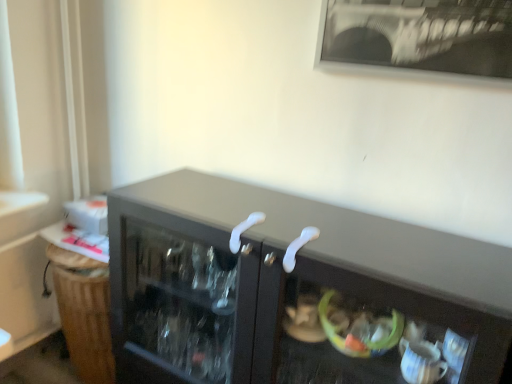
The height and width of the screenshot is (384, 512). What do you see at coordinates (298, 247) in the screenshot?
I see `white plastic door handle at center, which is counted as the second door handle, starting from the left` at bounding box center [298, 247].

You are a GUI agent. You are given a task and a screenshot of the screen. Output one action in this format:
    pyautogui.click(x=<x>, y=<y>)
    Task: Click on the white plastic door handle at center, which is counted as the second door handle, starting from the left
    
    Given the screenshot: What is the action you would take?
    pyautogui.click(x=298, y=247)

What is the approximate width of white plastic door handle at center, which is the 1th door handle in right-to-left order?

white plastic door handle at center, which is the 1th door handle in right-to-left order, is 6.50 inches in width.

Describe the element at coordinates (244, 230) in the screenshot. This screenshot has width=512, height=384. I see `white plastic door handle at center, the 1th door handle in the left-to-right sequence` at that location.

What is the approximate height of white plastic door handle at center, which is counted as the 2th door handle, starting from the right?

It is 3.61 inches.

This screenshot has width=512, height=384. I want to click on white plastic door handle at center, the 1th door handle in the left-to-right sequence, so click(x=244, y=230).

The height and width of the screenshot is (384, 512). Find the location of `white plastic door handle at center, which is the 1th door handle in right-to-left order`. white plastic door handle at center, which is the 1th door handle in right-to-left order is located at coordinates (298, 247).

Does white plastic door handle at center, the 1th door handle in the left-to-right sequence, appear on the left side of white plastic door handle at center, which is counted as the second door handle, starting from the left?

Indeed, white plastic door handle at center, the 1th door handle in the left-to-right sequence, is positioned on the left side of white plastic door handle at center, which is counted as the second door handle, starting from the left.

Which object is further away from the camera taking this photo, white plastic door handle at center, the 1th door handle in the left-to-right sequence, or white plastic door handle at center, which is the 1th door handle in right-to-left order?

white plastic door handle at center, the 1th door handle in the left-to-right sequence.

Which point is more distant from viewer, (247, 229) or (308, 236)?

The point (247, 229) is farther from the camera.

From the image's perspective, is white plastic door handle at center, the 1th door handle in the left-to-right sequence, above or below white plastic door handle at center, which is the 1th door handle in right-to-left order?

From the image's perspective, white plastic door handle at center, the 1th door handle in the left-to-right sequence, appears above white plastic door handle at center, which is the 1th door handle in right-to-left order.

From a real-world perspective, is white plastic door handle at center, which is counted as the 2th door handle, starting from the right, located higher than white plastic door handle at center, which is the 1th door handle in right-to-left order?

Indeed, from a real-world perspective, white plastic door handle at center, which is counted as the 2th door handle, starting from the right, stands above white plastic door handle at center, which is the 1th door handle in right-to-left order.

Is white plastic door handle at center, the 1th door handle in the left-to-right sequence, wider than white plastic door handle at center, which is the 1th door handle in right-to-left order?

Incorrect, the width of white plastic door handle at center, the 1th door handle in the left-to-right sequence, does not surpass that of white plastic door handle at center, which is the 1th door handle in right-to-left order.

Who is taller, white plastic door handle at center, which is counted as the 2th door handle, starting from the right, or white plastic door handle at center, which is the 1th door handle in right-to-left order?

white plastic door handle at center, which is counted as the 2th door handle, starting from the right.

Which of these two, white plastic door handle at center, the 1th door handle in the left-to-right sequence, or white plastic door handle at center, which is counted as the second door handle, starting from the left, is bigger?

white plastic door handle at center, which is counted as the second door handle, starting from the left.

Is white plastic door handle at center, which is counted as the 2th door handle, starting from the right, completely or partially outside of white plastic door handle at center, which is the 1th door handle in right-to-left order?

Yes.

Is the surface of white plastic door handle at center, which is counted as the 2th door handle, starting from the right, in direct contact with white plastic door handle at center, which is counted as the second door handle, starting from the left?

No, white plastic door handle at center, which is counted as the 2th door handle, starting from the right, is not touching white plastic door handle at center, which is counted as the second door handle, starting from the left.

Looking at this image, is white plastic door handle at center, which is counted as the 2th door handle, starting from the right, turned away from white plastic door handle at center, which is the 1th door handle in right-to-left order?

No.

Where is `door handle above the white plastic door handle at center, which is the 1th door handle in right-to-left order (from a real-world perspective)`? This screenshot has height=384, width=512. door handle above the white plastic door handle at center, which is the 1th door handle in right-to-left order (from a real-world perspective) is located at coordinates (244, 230).

Is white plastic door handle at center, which is counted as the second door handle, starting from the left, to the right of white plastic door handle at center, the 1th door handle in the left-to-right sequence, from the viewer's perspective?

Yes.

Is white plastic door handle at center, which is the 1th door handle in right-to-left order, positioned behind white plastic door handle at center, the 1th door handle in the left-to-right sequence?

No, the depth of white plastic door handle at center, which is the 1th door handle in right-to-left order, is less than that of white plastic door handle at center, the 1th door handle in the left-to-right sequence.

Considering the positions of point (305, 238) and point (241, 228), is point (305, 238) closer or farther from the camera than point (241, 228)?

Clearly, point (305, 238) is closer to the camera than point (241, 228).

From the image's perspective, does white plastic door handle at center, which is the 1th door handle in right-to-left order, appear lower than white plastic door handle at center, which is counted as the 2th door handle, starting from the right?

Yes.

From a real-world perspective, is white plastic door handle at center, which is counted as the second door handle, starting from the left, physically located above or below white plastic door handle at center, the 1th door handle in the left-to-right sequence?

In terms of real-world spatial position, white plastic door handle at center, which is counted as the second door handle, starting from the left, is below white plastic door handle at center, the 1th door handle in the left-to-right sequence.

Can you confirm if white plastic door handle at center, which is counted as the second door handle, starting from the left, is thinner than white plastic door handle at center, the 1th door handle in the left-to-right sequence?

No, white plastic door handle at center, which is counted as the second door handle, starting from the left, is not thinner than white plastic door handle at center, the 1th door handle in the left-to-right sequence.

Who is shorter, white plastic door handle at center, which is the 1th door handle in right-to-left order, or white plastic door handle at center, the 1th door handle in the left-to-right sequence?

white plastic door handle at center, which is the 1th door handle in right-to-left order, is shorter.

Can you confirm if white plastic door handle at center, which is counted as the second door handle, starting from the left, is bigger than white plastic door handle at center, the 1th door handle in the left-to-right sequence?

Yes.

Which is correct: white plastic door handle at center, which is the 1th door handle in right-to-left order, is inside white plastic door handle at center, which is counted as the 2th door handle, starting from the right, or outside of it?

white plastic door handle at center, which is the 1th door handle in right-to-left order, is outside white plastic door handle at center, which is counted as the 2th door handle, starting from the right.

Is white plastic door handle at center, which is the 1th door handle in right-to-left order, not near white plastic door handle at center, which is counted as the 2th door handle, starting from the right?

No.

Does white plastic door handle at center, which is the 1th door handle in right-to-left order, turn towards white plastic door handle at center, which is counted as the 2th door handle, starting from the right?

No, white plastic door handle at center, which is the 1th door handle in right-to-left order, does not turn towards white plastic door handle at center, which is counted as the 2th door handle, starting from the right.

What's the angular difference between white plastic door handle at center, which is the 1th door handle in right-to-left order, and white plastic door handle at center, which is counted as the 2th door handle, starting from the right,'s facing directions?

7.25e-05 degrees.

Identify the location of door handle below the white plastic door handle at center, the 1th door handle in the left-to-right sequence (from the image's perspective). (298, 247).

What are the coordinates of `door handle above the white plastic door handle at center, which is the 1th door handle in right-to-left order (from a real-world perspective)` in the screenshot? It's located at (244, 230).

Locate an element on the screen. door handle that appears behind the white plastic door handle at center, which is counted as the second door handle, starting from the left is located at coordinates (244, 230).